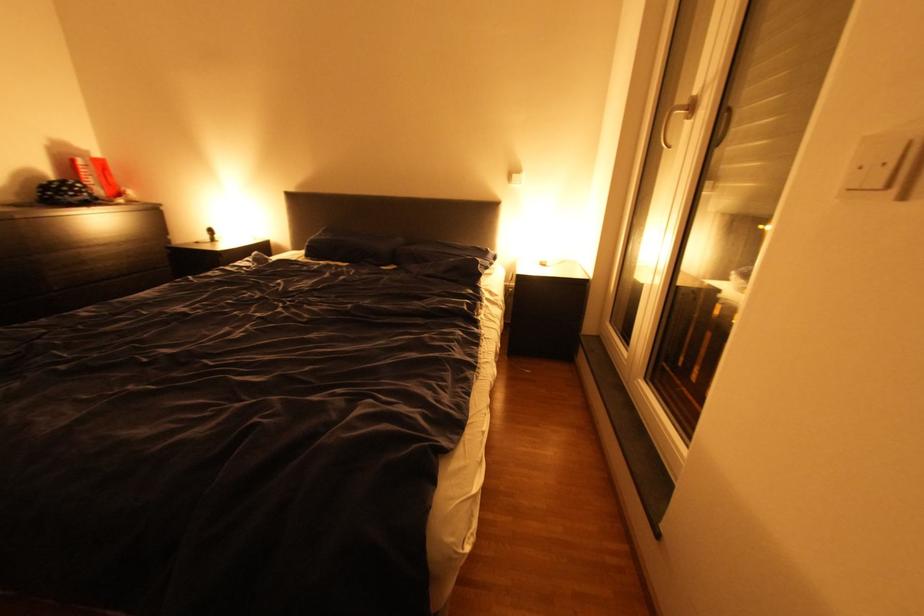
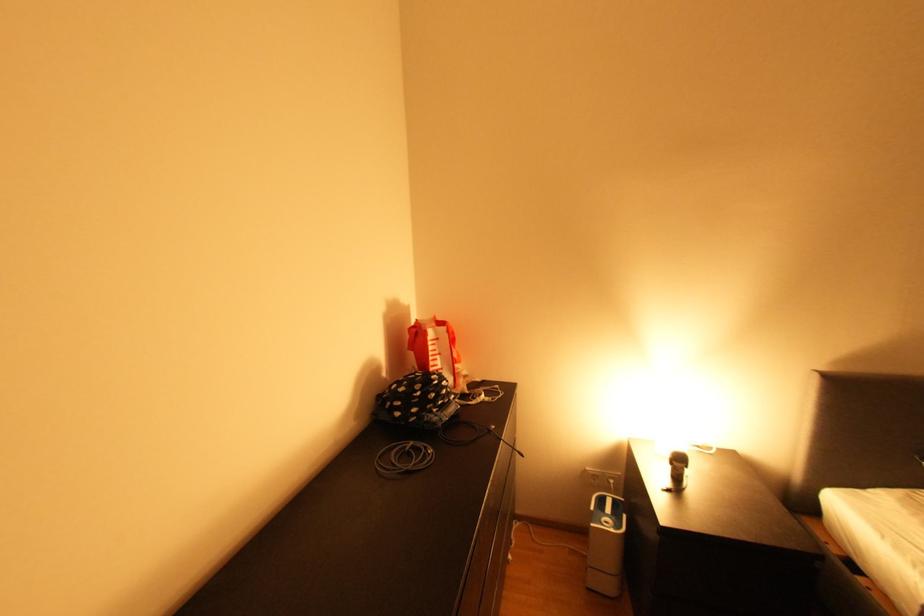
The images are taken continuously from a first-person perspective. In which direction are you moving?

The cameraman moved toward left, forward.